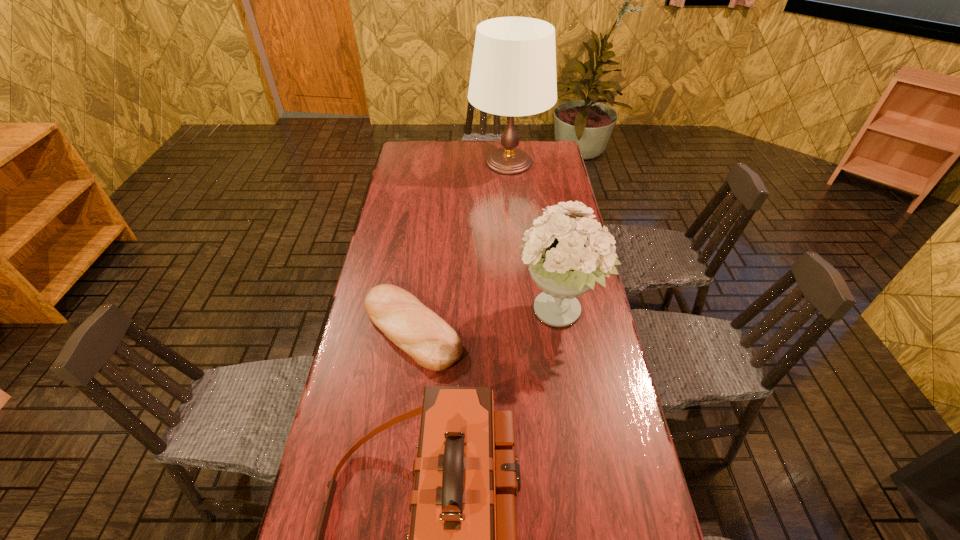
Locate an element on the screen. the farthest object is located at coordinates (513, 73).

This screenshot has height=540, width=960. In order to click on the tallest object in this screenshot , I will do `click(513, 73)`.

Identify the location of the third shortest object. (567, 255).

Identify the location of bread. The height and width of the screenshot is (540, 960). (433, 344).

The width and height of the screenshot is (960, 540). Identify the location of free location located 0.380m on the front of the tallest object. (516, 244).

Where is `free space located 0.060m on the back of the third shortest object`? This screenshot has height=540, width=960. free space located 0.060m on the back of the third shortest object is located at coordinates (551, 269).

The image size is (960, 540). I want to click on blank area located 0.240m on the right of the bread, so click(544, 329).

Find the location of a particular element. The height and width of the screenshot is (540, 960). object present at the far edge is located at coordinates (513, 73).

Locate an element on the screen. The image size is (960, 540). object that is at the left edge is located at coordinates (433, 344).

The image size is (960, 540). I want to click on lamp located in the right edge section of the desktop, so click(513, 73).